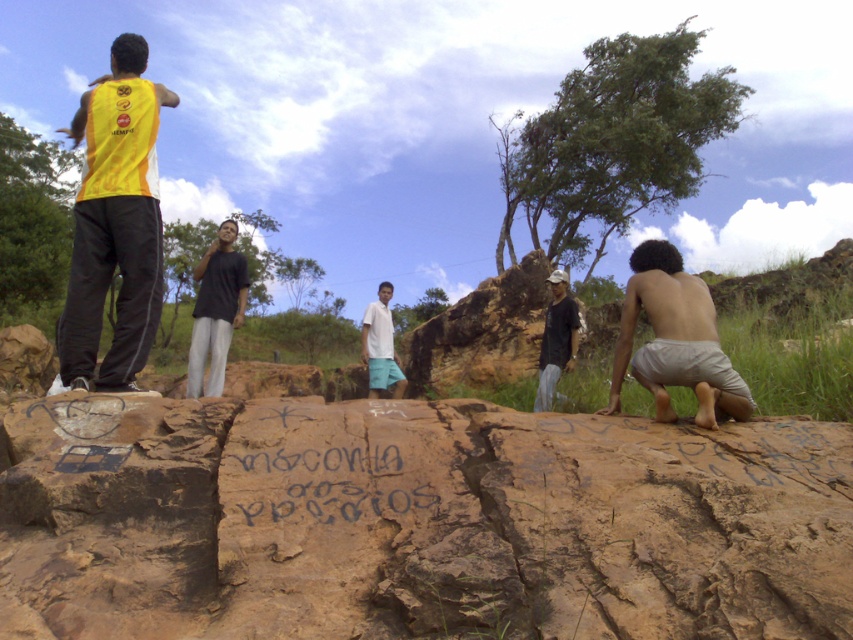
You are a photographer trying to capture a candid shot of the dark gray fabric shirt at center and the white cotton shirt at center. Since both are at the center, which one is closer to the camera?

The dark gray fabric shirt at center is positioned under the white cotton shirt at center, so it is closer to the camera.

You are a hiker who wants to place a 3 feet long hiking pole between the brown rough rock at center and the yellow fabric shirt at left. Can the pole fit between them without bending?

The brown rough rock at center is 9.44 feet away from the yellow fabric shirt at left. Since the pole is 3 feet long, it can easily fit between them without bending.

You are standing at point (155, 259) and want to walk to point (532, 493). Which direction should you move in relation to the camera angle?

Since point (532, 493) is closer to the viewer than point (155, 259), you should move towards the direction where the camera is facing to reach your destination.